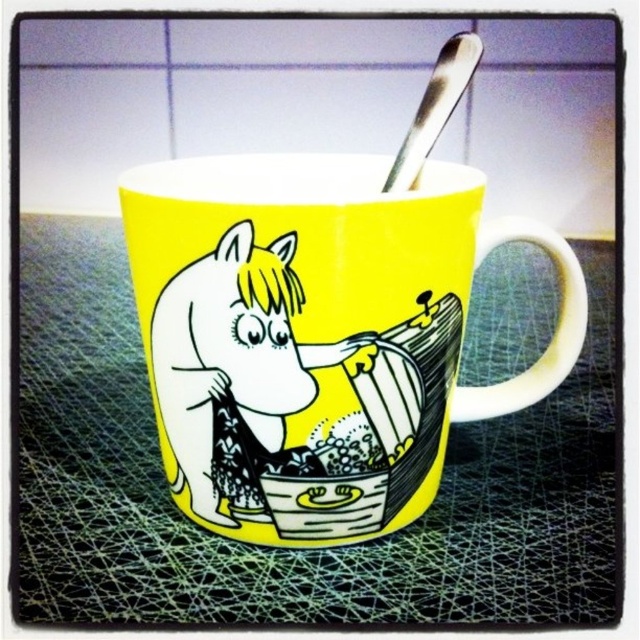
Between point (410, 454) and point (209, 372), which one is positioned behind?

The point (410, 454) is behind.

Which is more to the right, yellow ceramic mug at center or matte yellow horse at center?

From the viewer's perspective, yellow ceramic mug at center appears more on the right side.

Does point (218, 344) come in front of point (228, 497)?

That is True.

Image resolution: width=640 pixels, height=640 pixels. Find the location of `yellow ceramic mug at center`. yellow ceramic mug at center is located at coordinates (317, 332).